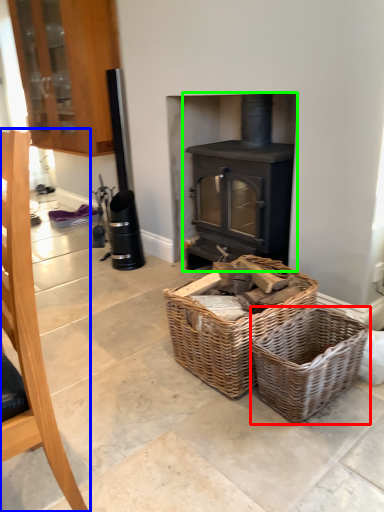
Question: Based on their relative distances, which object is nearer to basket (highlighted by a red box)? Choose from furniture (highlighted by a blue box) and wood burning stove (highlighted by a green box).

Choices:
 (A) furniture
 (B) wood burning stove

Answer: (B)